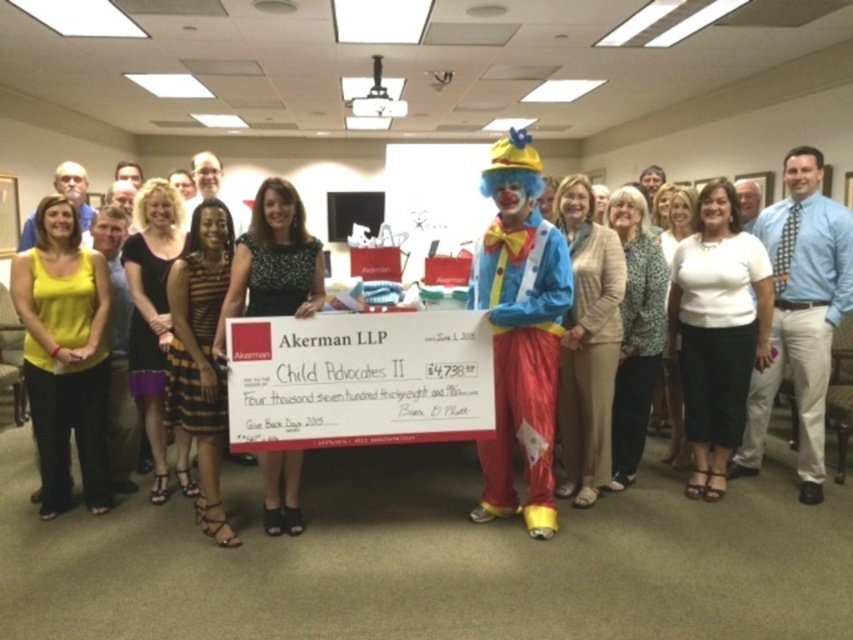
Does point (53, 289) come behind point (293, 248)?

Yes, it is behind point (293, 248).

Can you confirm if yellow fabric tank top at center is positioned to the right of matte black dress at center?

Incorrect, yellow fabric tank top at center is not on the right side of matte black dress at center.

Is point (13, 268) positioned before point (299, 243)?

That is False.

You are a GUI agent. You are given a task and a screenshot of the screen. Output one action in this format:
    pyautogui.click(x=<x>, y=<y>)
    Task: Click on the yellow fabric tank top at center
    This screenshot has height=640, width=853.
    Given the screenshot: What is the action you would take?
    pyautogui.click(x=65, y=355)

Who is taller, white matte blouse at center or matte black dress at center?

Standing taller between the two is white matte blouse at center.

Identify the location of white matte blouse at center. Image resolution: width=853 pixels, height=640 pixels. (717, 330).

This screenshot has width=853, height=640. What do you see at coordinates (717, 330) in the screenshot?
I see `white matte blouse at center` at bounding box center [717, 330].

You are a GUI agent. You are given a task and a screenshot of the screen. Output one action in this format:
    pyautogui.click(x=<x>, y=<y>)
    Task: Click on the white matte blouse at center
    The width and height of the screenshot is (853, 640).
    Given the screenshot: What is the action you would take?
    pyautogui.click(x=717, y=330)

Which is above, matte clown costume at center or blue tie at center?

Positioned higher is blue tie at center.

Is point (512, 349) positioned behind point (822, 230)?

No, it is not.

I want to click on matte clown costume at center, so click(520, 332).